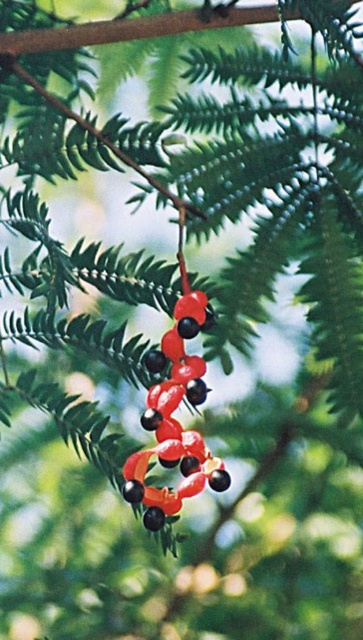
Question: Does glossy red berries at center have a lesser width compared to green matte branch at center?

Choices:
 (A) yes
 (B) no

Answer: (A)

Question: Does glossy red berries at center lie behind green matte branch at center?

Choices:
 (A) no
 (B) yes

Answer: (A)

Question: Among these objects, which one is farthest from the camera?

Choices:
 (A) glossy red berries at center
 (B) green matte branch at center

Answer: (B)

Question: Can you confirm if glossy red berries at center is positioned below green matte branch at center?

Choices:
 (A) no
 (B) yes

Answer: (B)

Question: Among these points, which one is farthest from the camera?

Choices:
 (A) (74, 36)
 (B) (157, 390)

Answer: (A)